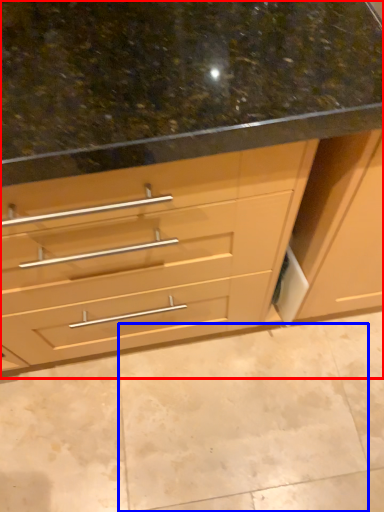
Question: Which of the following is the farthest to the observer, cabinetry (highlighted by a red box) or granite (highlighted by a blue box)?

Choices:
 (A) cabinetry
 (B) granite

Answer: (B)